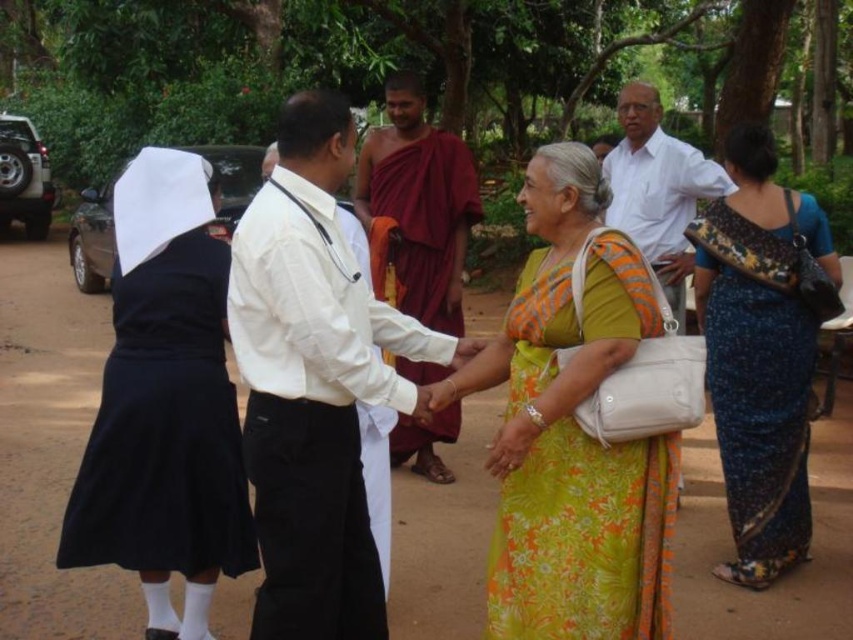
Between point (210, 413) and point (679, 234), which one is positioned in front?

Positioned in front is point (210, 413).

Measure the distance between point (189, 202) and camera.

3.29 meters

Is point (178, 426) closer to camera compared to point (730, 186)?

Yes.

This screenshot has width=853, height=640. I want to click on black fabric dress at left, so click(x=165, y=416).

Which is more to the right, white smooth shirt at center or black fabric dress at left?

white smooth shirt at center

Which is behind, point (456, 340) or point (149, 154)?

The point (149, 154) is behind.

At what (x,y) coordinates should I click in order to perform the action: click on white smooth shirt at center. Please return your answer as a coordinate pair (x, y). The height and width of the screenshot is (640, 853). Looking at the image, I should click on (315, 381).

Does point (326, 500) lie in front of point (664, 509)?

Yes, point (326, 500) is closer to viewer.

Who is shorter, white smooth shirt at center or green floral fabric dress at center?

Standing shorter between the two is green floral fabric dress at center.

You are a GUI agent. You are given a task and a screenshot of the screen. Output one action in this format:
    pyautogui.click(x=<x>, y=<y>)
    Task: Click on the white smooth shirt at center
    
    Given the screenshot: What is the action you would take?
    pyautogui.click(x=315, y=381)